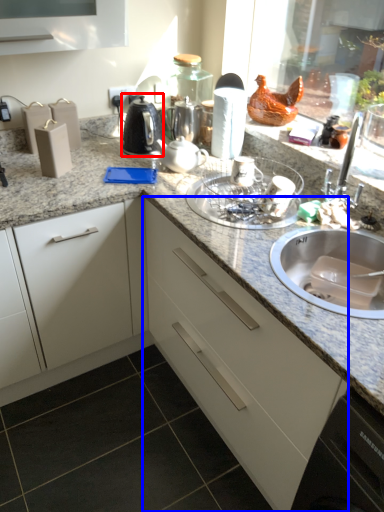
Question: Among these objects, which one is nearest to the camera, kitchen appliance (highlighted by a red box) or cabinetry (highlighted by a blue box)?

Choices:
 (A) kitchen appliance
 (B) cabinetry

Answer: (B)